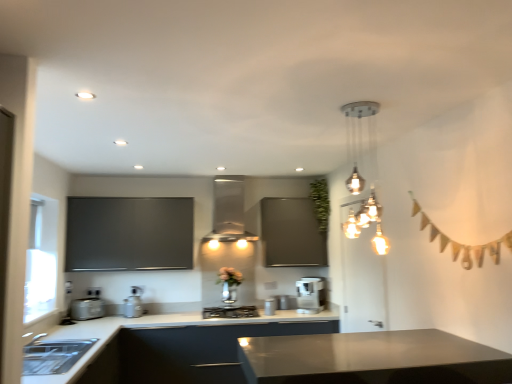
Question: From a real-world perspective, relative to satin silver coffee maker at center, the third appliance from the left, is satin silver toaster at lower left, acting as the third appliance starting from the right, vertically above or below?

Choices:
 (A) below
 (B) above

Answer: (B)

Question: In terms of size, does satin silver toaster at lower left, acting as the third appliance starting from the right, appear bigger or smaller than satin silver coffee maker at center, the 1th appliance positioned from the right?

Choices:
 (A) big
 (B) small

Answer: (A)

Question: Which is farther from the matte gray countertop at lower center?

Choices:
 (A) shiny metallic chandelier at upper right
 (B) white plastic electric outlet at lower left
 (C) satin silver coffee maker at center, the third appliance from the left
 (D) green leafy plant at upper center
 (E) satin silver toaster at lower left, which ranks as the 1th appliance in left-to-right order

Answer: (A)

Question: Which object is positioned closest to the satin silver coffee maker at center, the third appliance from the left?

Choices:
 (A) matte silver exhaust hood at center
 (B) shiny metallic chandelier at upper right
 (C) satin silver toaster at lower left, which appears as the second appliance when viewed from the left
 (D) satin silver coffee maker at center
 (E) matte gray countertop at lower center

Answer: (D)